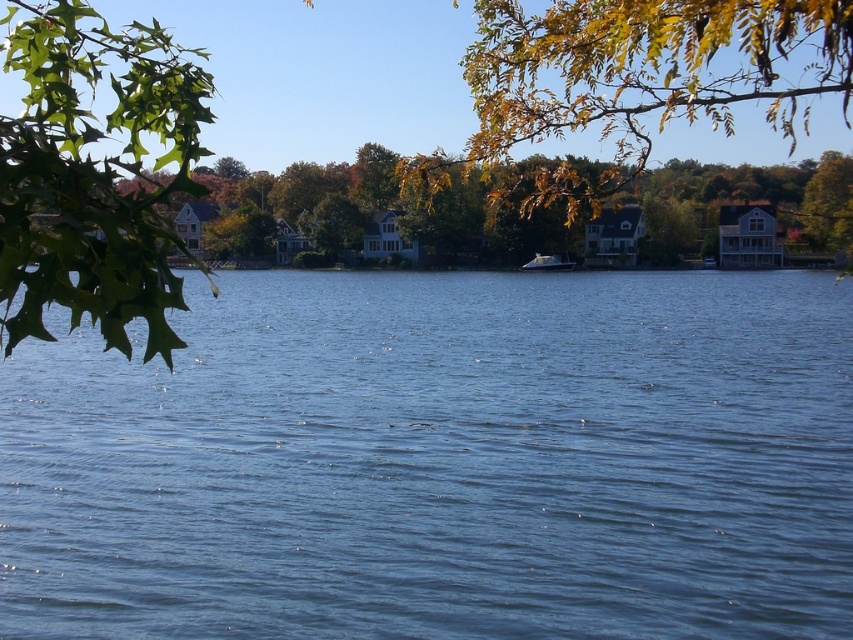
Is point (119, 99) farther from viewer compared to point (836, 202)?

That is False.

Does green leafy branch at upper left have a greater width compared to yellow-green leaves at upper center?

Incorrect, green leafy branch at upper left's width does not surpass yellow-green leaves at upper center's.

The height and width of the screenshot is (640, 853). What are the coordinates of `green leafy branch at upper left` in the screenshot? It's located at (93, 176).

Based on the photo, which is above, yellow-green leaves at upper center or white glossy boat at center?

Positioned higher is yellow-green leaves at upper center.

Which is behind, point (374, 241) or point (546, 259)?

The point (374, 241) is more distant.

Find the location of a particular element. yellow-green leaves at upper center is located at coordinates (381, 214).

Is yellow-green leaves at upper right taller than white glossy boat at center?

Indeed, yellow-green leaves at upper right has a greater height compared to white glossy boat at center.

Is point (630, 140) more distant than point (550, 266)?

No, it is in front of (550, 266).

Where is `yellow-green leaves at upper right`? This screenshot has width=853, height=640. yellow-green leaves at upper right is located at coordinates (631, 81).